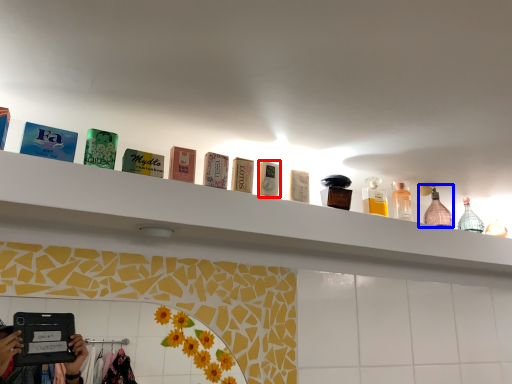
Question: Which object appears farthest to the camera in this image, product (highlighted by a red box) or mouthwash (highlighted by a blue box)?

Choices:
 (A) product
 (B) mouthwash

Answer: (B)